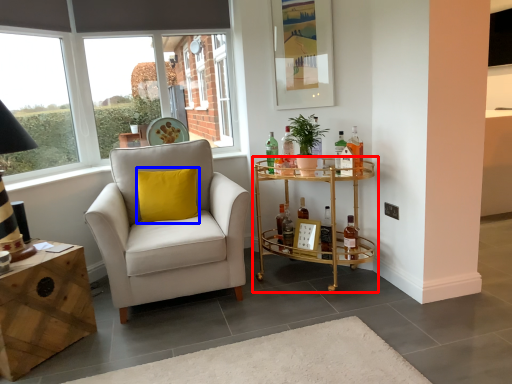
Question: Among these objects, which one is nearest to the camera, shelf (highlighted by a red box) or pillow (highlighted by a blue box)?

Choices:
 (A) shelf
 (B) pillow

Answer: (A)